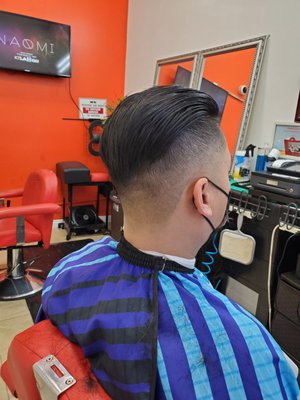
Image resolution: width=300 pixels, height=400 pixels. Identify the location of tv  on wall top left. (34, 48).